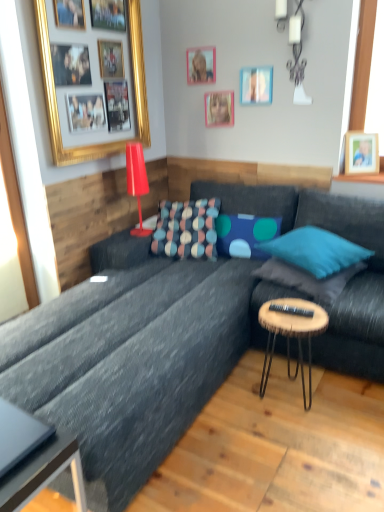
Question: Visually, is wooden picture frame at upper center, which is the 2th picture frame from right to left, positioned to the left or to the right of metallic gray coffee table at lower left?

Choices:
 (A) left
 (B) right

Answer: (B)

Question: From a real-world perspective, is wooden picture frame at upper center, which is the 2th picture frame from right to left, positioned above or below metallic gray coffee table at lower left?

Choices:
 (A) above
 (B) below

Answer: (A)

Question: Which of these objects is positioned closest to the matte pink picture frame at upper center, acting as the third picture frame starting from the left?

Choices:
 (A) wooden photo frame at upper right, the 1th picture frame from the right
 (B) wooden stool at center
 (C) black plastic remote control at center
 (D) blue felt pillow at center, arranged as the 2th pillow when viewed from the left
 (E) textured gray couch at center

Answer: (D)

Question: Which object is the closest to the teal fabric pillow at center, arranged as the 2th pillow when viewed from the right?

Choices:
 (A) textured fabric pillow at center, the 4th pillow from the right
 (B) white ceramic lamp at upper center, the 1th lamp in the right-to-left sequence
 (C) textured gray couch at center
 (D) wooden photo frame at upper right, acting as the 5th picture frame starting from the left
 (E) matte red lamp at upper left, the 2th lamp when ordered from right to left

Answer: (C)